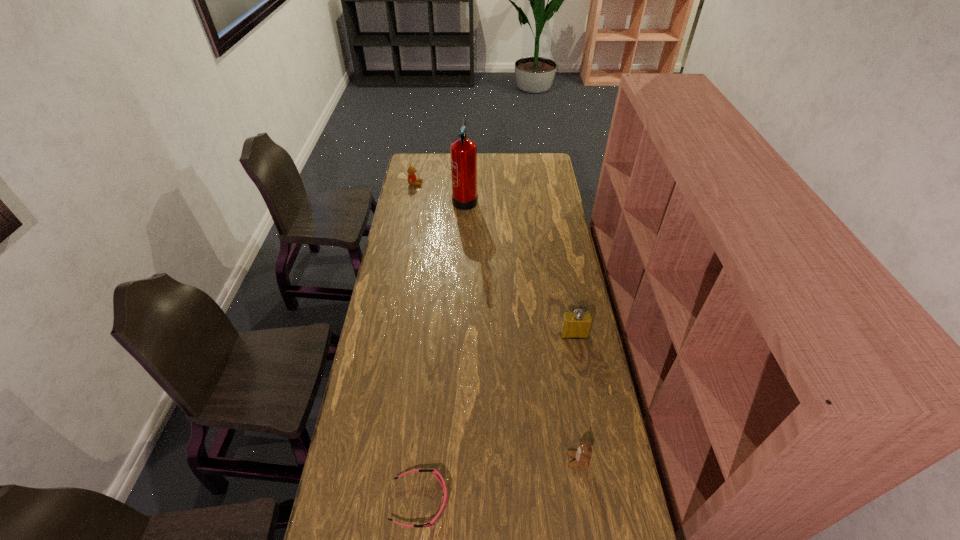
Where is `free space between the fourth tallest object and the goggles`? This screenshot has height=540, width=960. free space between the fourth tallest object and the goggles is located at coordinates (499, 481).

This screenshot has width=960, height=540. What are the coordinates of `object that can be found as the third closest to the fire extinguisher` in the screenshot? It's located at (582, 456).

At what (x,y) coordinates should I click in order to perform the action: click on the second closest object to the fire extinguisher. Please return your answer as a coordinate pair (x, y). Looking at the image, I should click on (577, 324).

I want to click on vacant space that satisfies the following two spatial constraints: 1. on the front-facing side of the third farthest object; 2. on the front-facing side of the nearer teddy bear, so click(597, 460).

Image resolution: width=960 pixels, height=540 pixels. In order to click on free point that satisfies the following two spatial constraints: 1. on the front-facing side of the left teddy bear; 2. on the back side of the tallest object in this screenshot , I will do `click(413, 198)`.

Locate an element on the screen. The height and width of the screenshot is (540, 960). blank space that satisfies the following two spatial constraints: 1. on the front side of the tallest object; 2. on the front-facing side of the goggles is located at coordinates (453, 501).

Identify the location of vacant space that satisfies the following two spatial constraints: 1. on the front-facing side of the farther teddy bear; 2. on the left side of the fire extinguisher. (413, 198).

Image resolution: width=960 pixels, height=540 pixels. In order to click on vacant region that satisfies the following two spatial constraints: 1. on the front-facing side of the third nearest object; 2. on the front-facing side of the shortest object in this screenshot , I will do `click(605, 501)`.